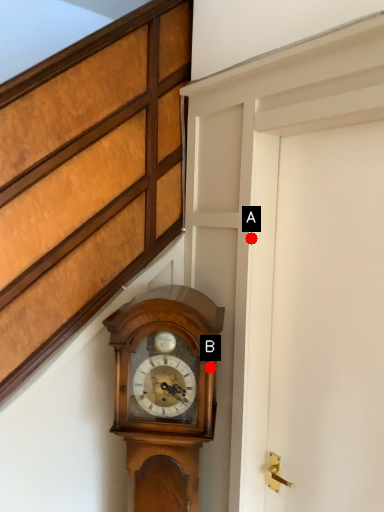
Question: Two points are circled on the image, labeled by A and B beside each circle. Among these points, which one is nearest to the camera?

Choices:
 (A) A is closer
 (B) B is closer

Answer: (B)